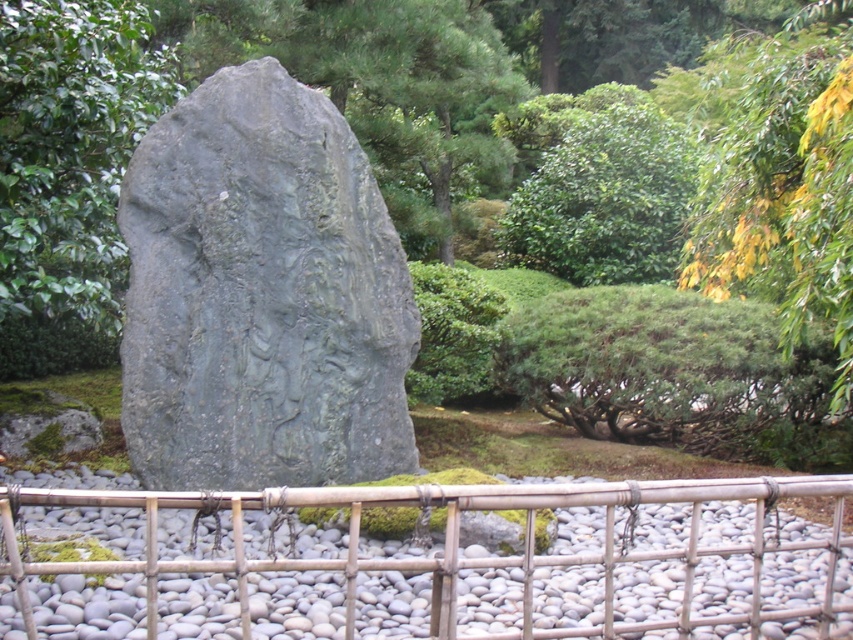
You are a gardener who wants to plant a new flower bed between the gray stone carving at center and the green leafy bush at upper center. Considering their sizes, which object should you place the flowers closer to?

The gray stone carving at center is smaller than the green leafy bush at upper center, so you should place the flowers closer to the gray stone carving at center to balance the sizes.

You are standing in the garden and want to place a small statue on the ground near the white pebbles at center. Considering the height of the green leafy tree at center, will the statue be visible from your current position?

The white pebbles at center has a lesser height compared to the green leafy tree at center, so the statue placed near the white pebbles at center may be partially obscured by the taller green leafy tree at center, making it less visible.